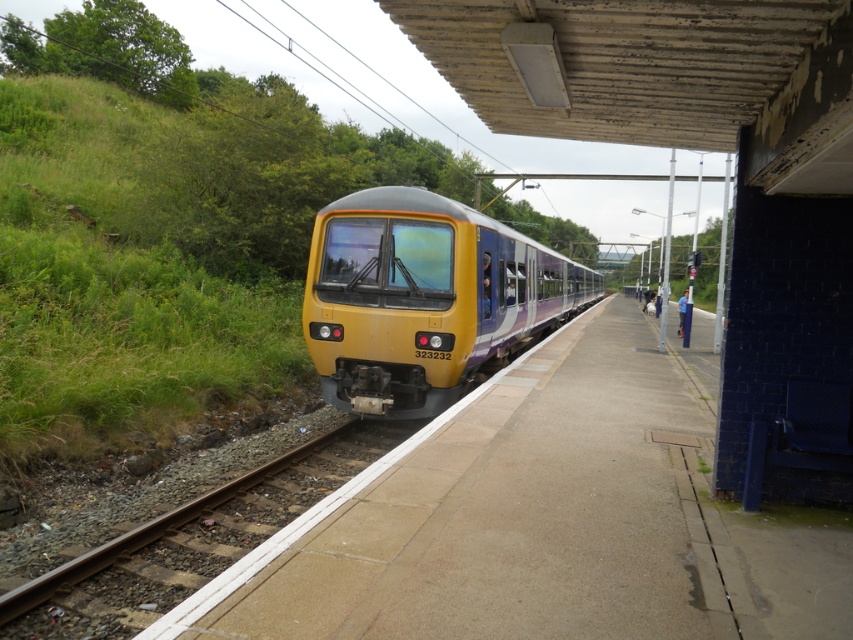
At what (x,y) coordinates should I click in order to perform the action: click on yellow matte train at center. Please return your answer as a coordinate pair (x, y). Looking at the image, I should click on (425, 298).

I want to click on yellow matte train at center, so click(x=425, y=298).